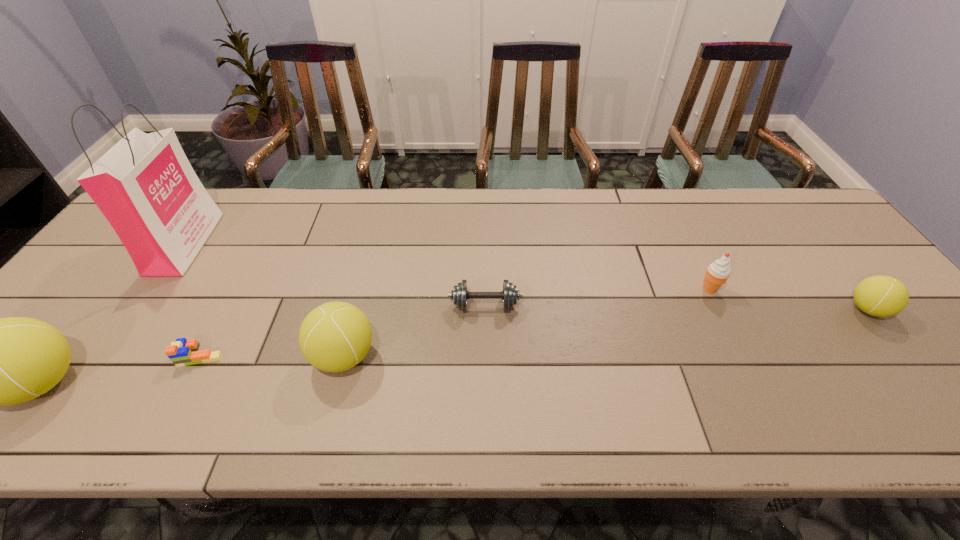
In order to click on empty space that is in between the shopping bag and the fourth object from right to left in this screenshot , I will do `click(264, 300)`.

The width and height of the screenshot is (960, 540). Identify the location of free space between the sixth object from left to right and the farthest object. (447, 266).

This screenshot has width=960, height=540. I want to click on vacant region between the sixth object from left to right and the dumbbell, so click(597, 297).

Find the location of a particular element. The width and height of the screenshot is (960, 540). free area in between the shopping bag and the second shortest tennis ball is located at coordinates (264, 300).

Where is `free space between the third object from left to right and the farthest tennis ball`? Image resolution: width=960 pixels, height=540 pixels. free space between the third object from left to right and the farthest tennis ball is located at coordinates (534, 333).

This screenshot has width=960, height=540. I want to click on object that is the sixth closest to the rightmost object, so click(x=0, y=361).

Point out which object is positioned as the fourth nearest to the icecream. Please provide its 2D coordinates. Your answer should be formatted as a tuple, i.e. [(x, y)], where the tuple contains the x and y coordinates of a point satisfying the conditions above.

[(182, 352)]

The image size is (960, 540). What are the coordinates of `tennis ball identified as the second closest to the third object from left to right` in the screenshot? It's located at (334, 337).

Select which tennis ball is the second closest to the icecream. Please provide its 2D coordinates. Your answer should be formatted as a tuple, i.e. [(x, y)], where the tuple contains the x and y coordinates of a point satisfying the conditions above.

[(334, 337)]

The height and width of the screenshot is (540, 960). In order to click on free region that satisfies the following two spatial constraints: 1. on the front-facing side of the tallest object; 2. on the back side of the farthest tennis ball in this screenshot , I will do `click(139, 309)`.